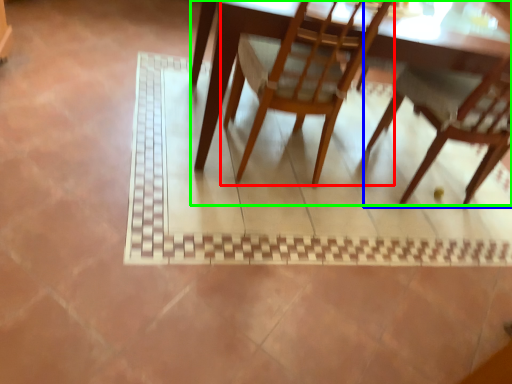
Question: Which is nearer to the chair (highlighted by a red box)? chair (highlighted by a blue box) or table (highlighted by a green box).

Choices:
 (A) chair
 (B) table

Answer: (B)